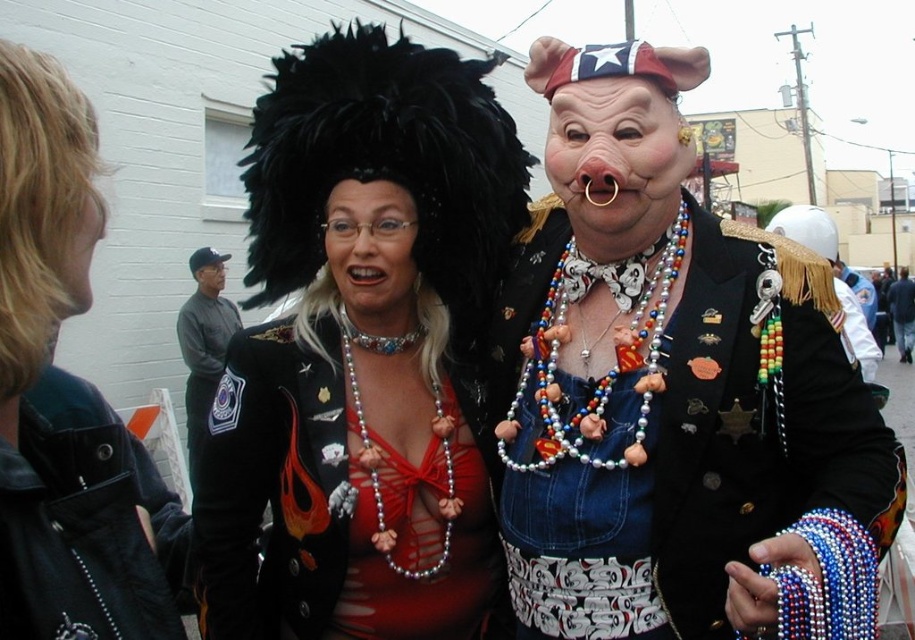
Is beaded necklace with figurines at center in front of matte plastic pig mask at center?

Yes, beaded necklace with figurines at center is closer to the viewer.

Does beaded necklace with figurines at center appear on the left side of matte plastic pig mask at center?

Incorrect, beaded necklace with figurines at center is not on the left side of matte plastic pig mask at center.

The width and height of the screenshot is (915, 640). What do you see at coordinates (819, 419) in the screenshot?
I see `beaded necklace with figurines at center` at bounding box center [819, 419].

Image resolution: width=915 pixels, height=640 pixels. I want to click on beaded necklace with figurines at center, so click(819, 419).

Between shiny black leather jacket at center and dark brown leather jacket at center, which one is positioned lower?

shiny black leather jacket at center

Can you confirm if shiny black leather jacket at center is taller than dark brown leather jacket at center?

In fact, shiny black leather jacket at center may be shorter than dark brown leather jacket at center.

Is point (66, 436) positioned before point (905, 307)?

Yes.

Identify the location of shiny black leather jacket at center. This screenshot has height=640, width=915. (66, 396).

Is shiny black leather jacket at center positioned at the back of matte plastic pig mask at center?

No, it is in front of matte plastic pig mask at center.

Is shiny black leather jacket at center above matte plastic pig mask at center?

Incorrect, shiny black leather jacket at center is not positioned above matte plastic pig mask at center.

Does point (63, 204) lie behind point (623, 179)?

No, (63, 204) is in front of (623, 179).

The height and width of the screenshot is (640, 915). Find the location of `shiny black leather jacket at center`. shiny black leather jacket at center is located at coordinates (66, 396).